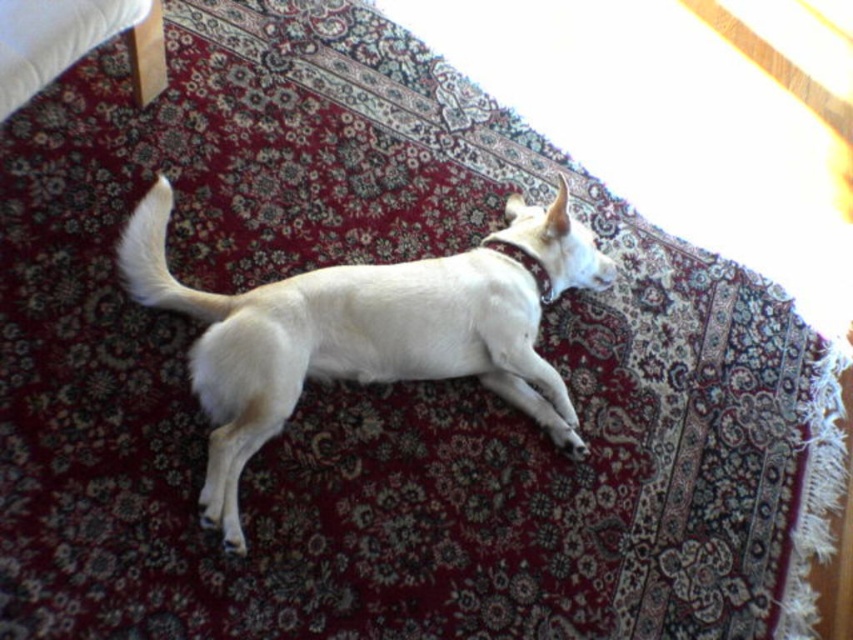
Based on the photo, can you confirm if white fur dog at center is wider than maroon leather neckband at upper center?

Yes, white fur dog at center is wider than maroon leather neckband at upper center.

Can you confirm if white fur dog at center is bigger than maroon leather neckband at upper center?

Yes, white fur dog at center is bigger than maroon leather neckband at upper center.

This screenshot has height=640, width=853. I want to click on white fur dog at center, so click(x=341, y=340).